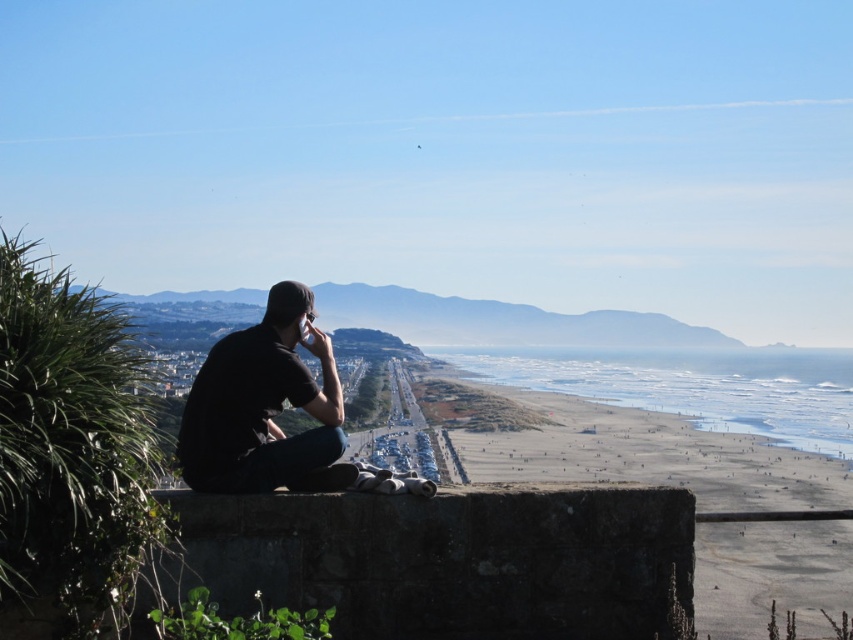
Consider the image. You are standing at the stone ledge where the person is sitting. Which direction should you walk to reach the smooth sand beach at center?

The smooth sand beach at center is located at point [647,452], so you should walk towards the center of the image to reach it.

You are a photographer trying to capture the smooth sand beach at center and the black matte shirt at left in a single shot. Which object should you focus on first to ensure both are in the frame?

The black matte shirt at left is behind the smooth sand beach at center, so you should focus on the smooth sand beach at center first to ensure both are in the frame.

You are a photographer wanting to capture the smooth sand beach at center and the black matte shirt at left in the same frame. Based on their positions, which object should you focus on first to ensure both are in the shot?

The smooth sand beach at center is located below the black matte shirt at left, so you should focus on the black matte shirt at left first to ensure both are in the frame.